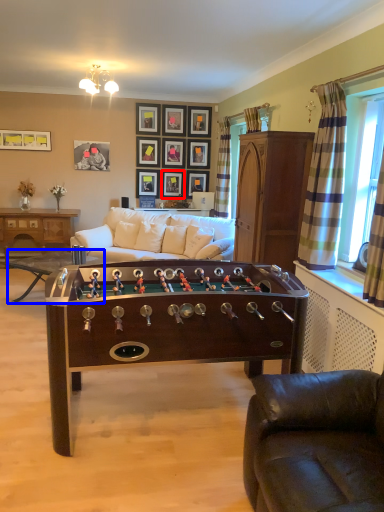
Question: Which object appears closest to the camera in this image, picture frame (highlighted by a red box) or table (highlighted by a blue box)?

Choices:
 (A) picture frame
 (B) table

Answer: (B)